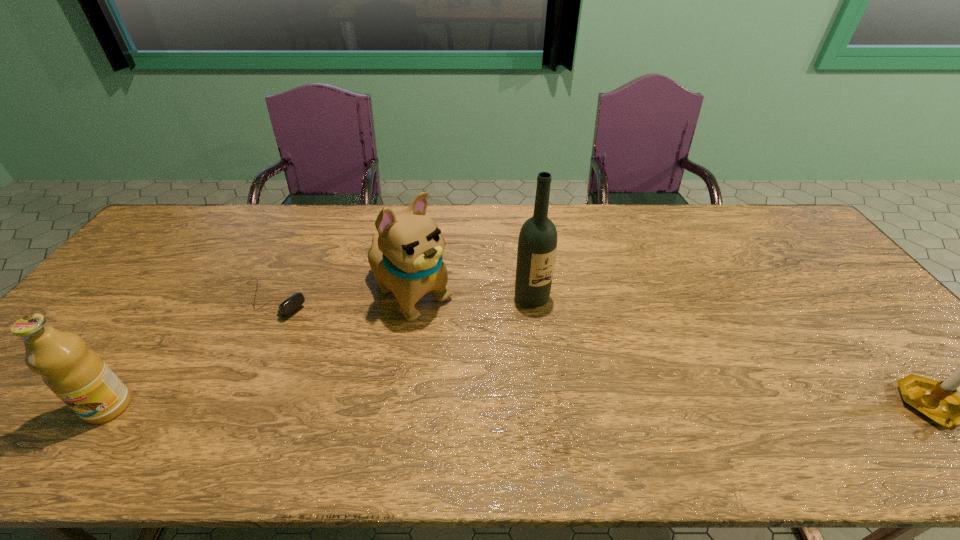
The width and height of the screenshot is (960, 540). Find the location of `vacant space situated on the front-facing side of the shortest object`. vacant space situated on the front-facing side of the shortest object is located at coordinates (328, 330).

Image resolution: width=960 pixels, height=540 pixels. I want to click on vacant area situated on the front-facing side of the shortest object, so click(375, 359).

Find the location of a particular element. This screenshot has height=540, width=960. vacant area situated 0.310m on the front-facing side of the shortest object is located at coordinates (381, 362).

Identify the location of vacant space positioned 0.170m on the face of the fourth shortest object. (480, 353).

Image resolution: width=960 pixels, height=540 pixels. I want to click on blank space located 0.150m on the face of the fourth shortest object, so click(474, 349).

Where is `vacant space located on the face of the fourth shortest object`? vacant space located on the face of the fourth shortest object is located at coordinates (486, 358).

Where is `object at the near edge`? The height and width of the screenshot is (540, 960). object at the near edge is located at coordinates (78, 376).

Image resolution: width=960 pixels, height=540 pixels. I want to click on vacant space at the far edge of the desktop, so [x=466, y=215].

The height and width of the screenshot is (540, 960). Identify the location of free space at the near edge. (775, 399).

Locate an element on the screen. This screenshot has height=540, width=960. vacant area at the left edge is located at coordinates (162, 248).